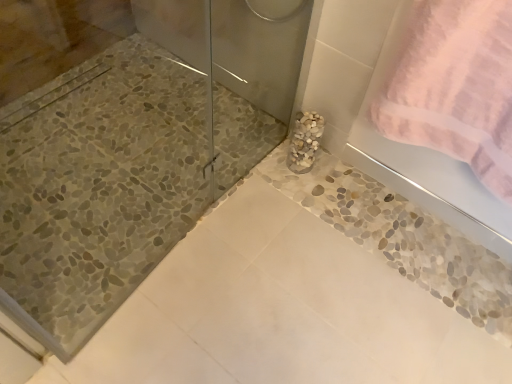
Question: Is pink terry cloth towel at upper right to the left or to the right of white pebble vase at center in the image?

Choices:
 (A) right
 (B) left

Answer: (A)

Question: In terms of size, does pink terry cloth towel at upper right appear bigger or smaller than white pebble vase at center?

Choices:
 (A) big
 (B) small

Answer: (A)

Question: Is pink terry cloth towel at upper right taller or shorter than white pebble vase at center?

Choices:
 (A) tall
 (B) short

Answer: (A)

Question: From the image's perspective, is white pebble vase at center above or below pink terry cloth towel at upper right?

Choices:
 (A) above
 (B) below

Answer: (B)

Question: Considering their positions, is white pebble vase at center located in front of or behind pink terry cloth towel at upper right?

Choices:
 (A) behind
 (B) front

Answer: (A)

Question: From a real-world perspective, is white pebble vase at center physically located above or below pink terry cloth towel at upper right?

Choices:
 (A) above
 (B) below

Answer: (B)

Question: Choose the correct answer: Is white pebble vase at center inside pink terry cloth towel at upper right or outside it?

Choices:
 (A) outside
 (B) inside

Answer: (A)